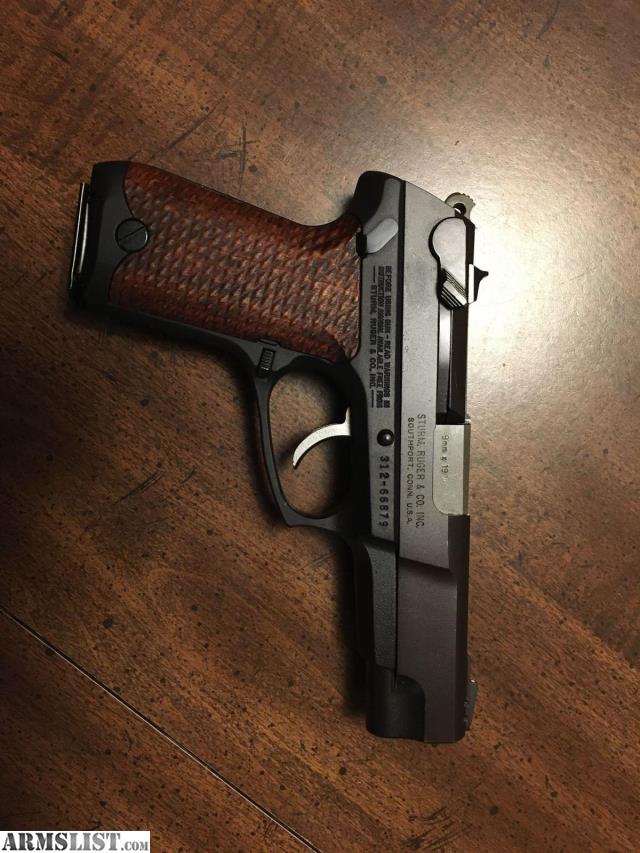
Where is `laminate table`? laminate table is located at coordinates (258, 665).